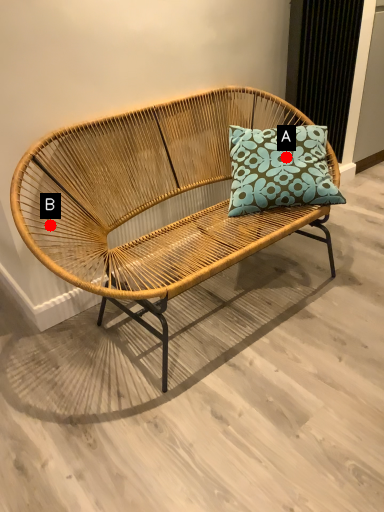
Question: Two points are circled on the image, labeled by A and B beside each circle. Which of the following is the farthest from the observer?

Choices:
 (A) A is further
 (B) B is further

Answer: (A)